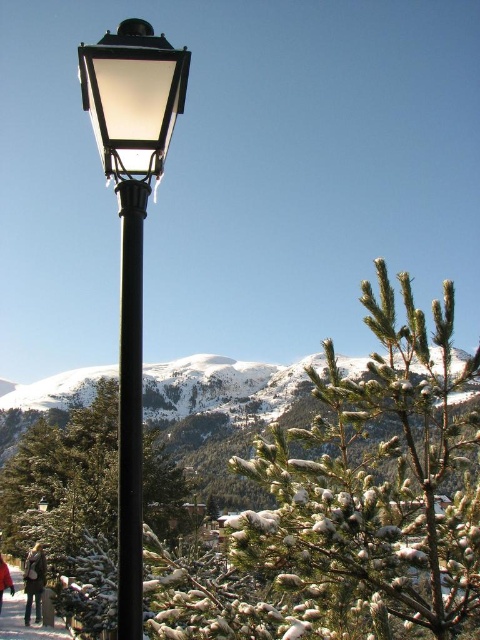
Question: Estimate the real-world distances between objects in this image. Which object is farther from the matte glass streetlight at upper left?

Choices:
 (A) red woolen coat at lower left
 (B) matte black street light at left
 (C) light brown leather jacket at lower left

Answer: (C)

Question: Observing the image, what is the correct spatial positioning of matte glass streetlight at upper left in reference to red woolen coat at lower left?

Choices:
 (A) above
 (B) below

Answer: (A)

Question: Estimate the real-world distances between objects in this image. Which object is closer to the matte black street light at left?

Choices:
 (A) matte black pole at lower left
 (B) snowy white mountain at center

Answer: (A)

Question: Is snowy white mountain at center positioned before matte glass streetlight at upper left?

Choices:
 (A) yes
 (B) no

Answer: (B)

Question: Does light brown leather jacket at lower left have a greater width compared to red woolen coat at lower left?

Choices:
 (A) no
 (B) yes

Answer: (B)

Question: Which point is closer to the camera?

Choices:
 (A) matte black street light at left
 (B) matte black pole at lower left

Answer: (A)